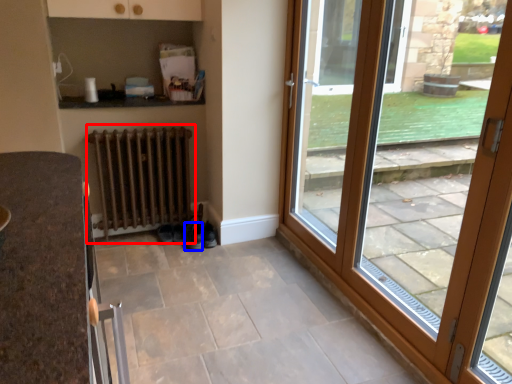
Question: Which point is closer to the camera, radiator (highlighted by a red box) or shoe (highlighted by a blue box)?

Choices:
 (A) radiator
 (B) shoe

Answer: (A)